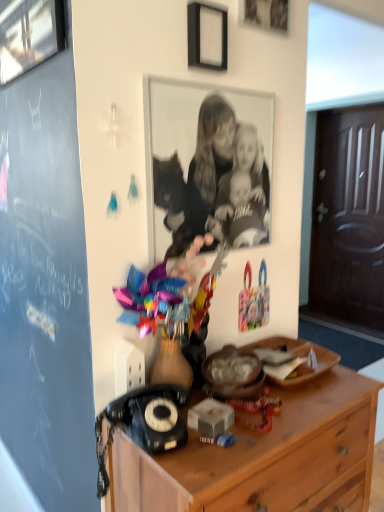
Locate an element on the screen. vacant point to the right of metallic silver toy at center is located at coordinates (286, 416).